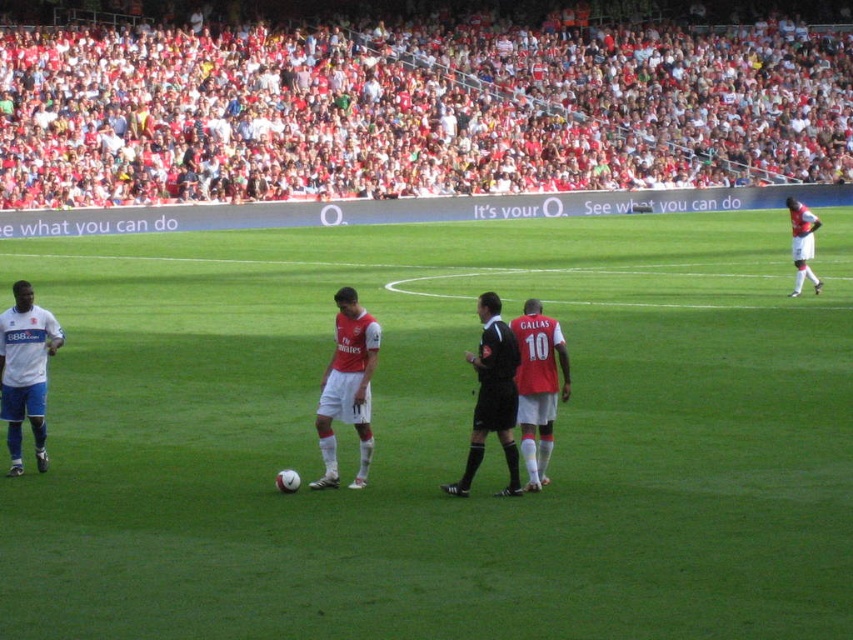
Which is below, red fabric crowd at upper center or matte red jersey at center?

matte red jersey at center is below.

Between red fabric crowd at upper center and matte red jersey at center, which one has more height?

red fabric crowd at upper center is taller.

I want to click on red fabric crowd at upper center, so click(x=413, y=108).

Who is shorter, green grass field at center or black jersey at center?

Standing shorter between the two is black jersey at center.

Does green grass field at center have a lesser width compared to black jersey at center?

No.

Which is in front, point (564, 273) or point (505, 422)?

Point (505, 422) is more forward.

At what (x,y) coordinates should I click in order to perform the action: click on green grass field at center. Please return your answer as a coordinate pair (x, y). Looking at the image, I should click on (438, 436).

Who is positioned more to the left, green grass field at center or white matte jersey at left?

Positioned to the left is white matte jersey at left.

Is point (83, 352) closer to viewer compared to point (20, 429)?

No.

This screenshot has height=640, width=853. What do you see at coordinates (438, 436) in the screenshot?
I see `green grass field at center` at bounding box center [438, 436].

Where is `green grass field at center`? The image size is (853, 640). green grass field at center is located at coordinates (438, 436).